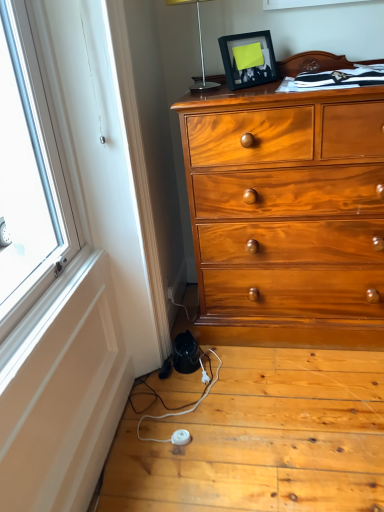
Question: From their relative heights in the image, would you say black matte picture frame at upper center is taller or shorter than white plastic power strip at lower center?

Choices:
 (A) short
 (B) tall

Answer: (B)

Question: From a real-world perspective, relative to white plastic power strip at lower center, is black matte picture frame at upper center vertically above or below?

Choices:
 (A) below
 (B) above

Answer: (B)

Question: Which of these objects is positioned farthest from the white plastic power strip at lower center?

Choices:
 (A) silver metallic table lamp at upper center
 (B) black matte picture frame at upper center

Answer: (A)

Question: Considering the real-world distances, which object is farthest from the white plastic power strip at lower center?

Choices:
 (A) silver metallic table lamp at upper center
 (B) black matte picture frame at upper center

Answer: (A)